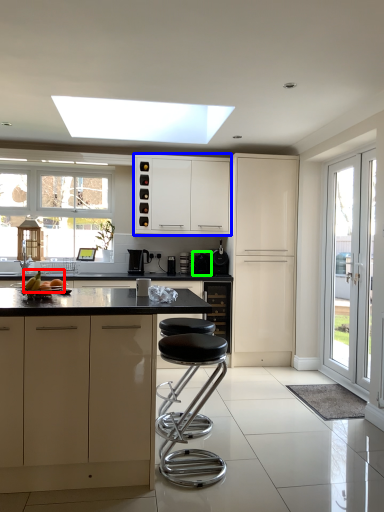
Question: Based on their relative distances, which object is nearer to fruit (highlighted by a red box)? Choose from cabinetry (highlighted by a blue box) and appliance (highlighted by a green box).

Choices:
 (A) cabinetry
 (B) appliance

Answer: (A)